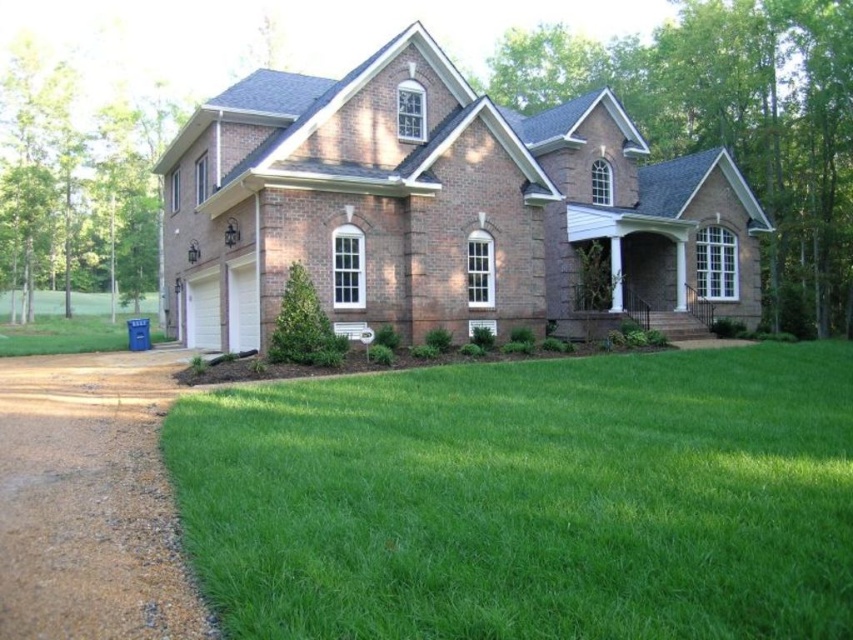
Looking at this image, you are standing at the front door of the two story brick house. You see a point marked at coordinates (527, 499) which corresponds to an area in the image. What is located at that point?

The point at coordinates (527, 499) marks green grass at lower center.

You are a gardener who needs to move a 3.5 meter long hose from the green grass at lower center to the brown gravel driveway at lower left. Is the distance sufficient for the hose to reach without moving it?

The distance between the green grass at lower center and the brown gravel driveway at lower left is 3.25 meters. Since the hose is 3.5 meters long, it is slightly longer than the distance, so the hose can reach without needing to be moved.

You are standing at the front door of the house and want to walk to the green grass at lower center. Which direction should you head relative to the brown gravel driveway at lower left?

You should head towards the green grass at lower center, which is located in front of the brown gravel driveway at lower left, so you would move forward away from the driveway towards the grass.